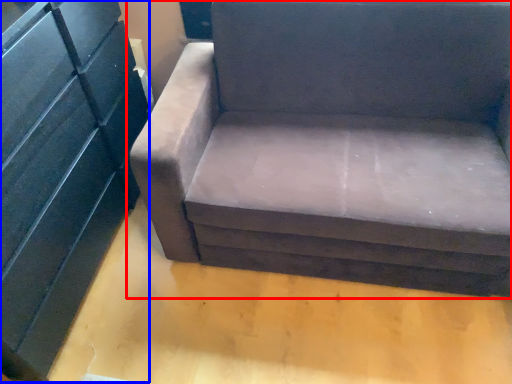
Question: Among these objects, which one is nearest to the camera, studio couch (highlighted by a red box) or dresser (highlighted by a blue box)?

Choices:
 (A) studio couch
 (B) dresser

Answer: (B)